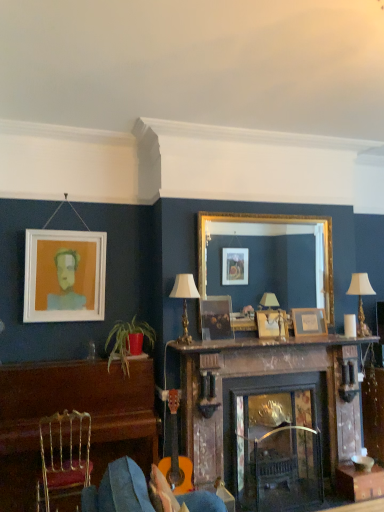
At what (x,y) coordinates should I click in order to perform the action: click on vacant space situated above gold-framed mirror at center (from a real-world perspective). Please return your answer as a coordinate pair (x, y). The height and width of the screenshot is (512, 384). Looking at the image, I should click on (269, 210).